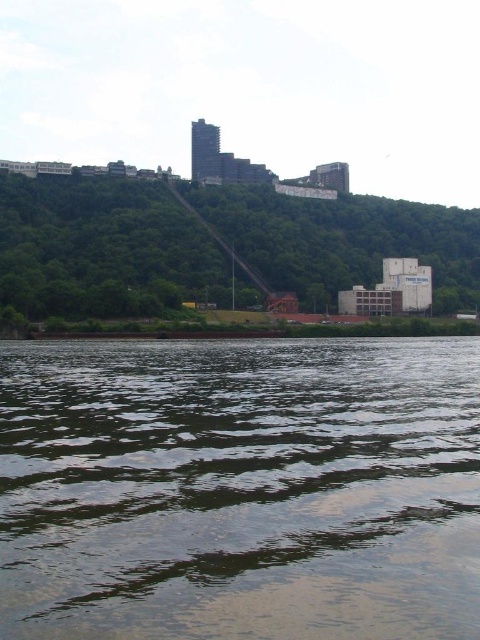
Question: Which point is closer to the camera?

Choices:
 (A) green leafy hillside at upper center
 (B) greenish reflective water at lower center

Answer: (B)

Question: Considering the relative positions of greenish reflective water at lower center and green leafy hillside at upper center in the image provided, where is greenish reflective water at lower center located with respect to green leafy hillside at upper center?

Choices:
 (A) below
 (B) above

Answer: (A)

Question: Is greenish reflective water at lower center thinner than green leafy hillside at upper center?

Choices:
 (A) yes
 (B) no

Answer: (A)

Question: Which object appears closest to the camera in this image?

Choices:
 (A) green leafy hillside at upper center
 (B) greenish reflective water at lower center

Answer: (B)

Question: Is greenish reflective water at lower center bigger than green leafy hillside at upper center?

Choices:
 (A) no
 (B) yes

Answer: (A)

Question: Which point appears closest to the camera in this image?

Choices:
 (A) (308, 536)
 (B) (31, 298)

Answer: (A)